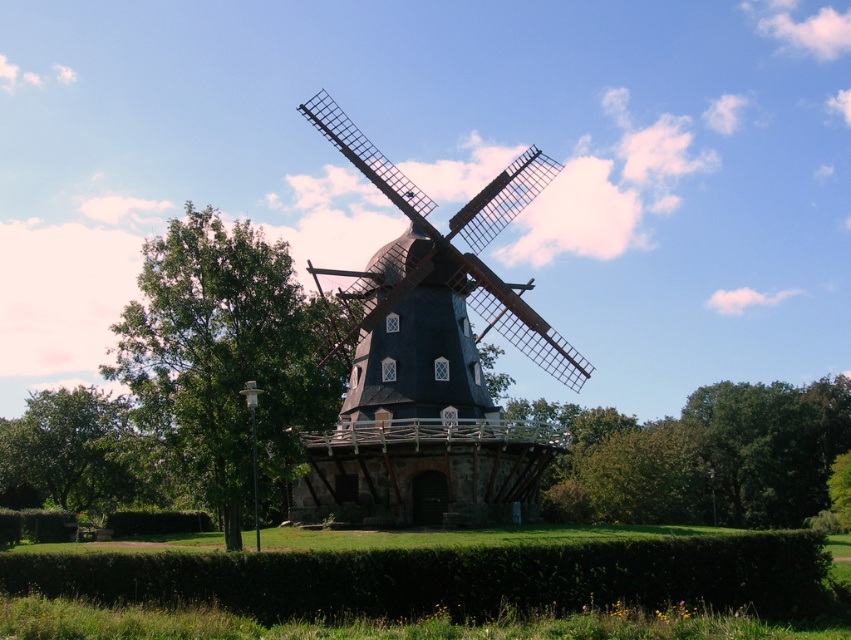
Consider the image. You are standing at the base of the windmill and want to walk to the point marked by point (375, 497). However, there is an obstacle at point (73, 413). Based on their positions, will you encounter the obstacle before reaching your destination?

Point (375, 497) is in front of point (73, 413), so you will reach the destination before encountering the obstacle.

You are standing in front of the windmill and notice two green leafy trees. Which tree, the green leafy tree at left or the green leafy tree at center, is positioned higher in the image?

The green leafy tree at left is positioned higher in the image than the green leafy tree at center.

You are standing in the field near the dark gray wooden windmill at center and the green leafy tree at lower left. Which object would cast a longer shadow at noon?

The dark gray wooden windmill at center is taller than the green leafy tree at lower left, so it would cast a longer shadow at noon.